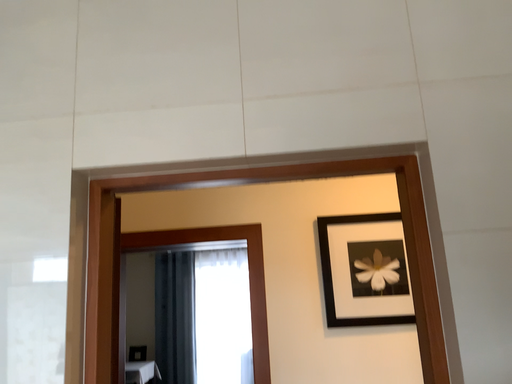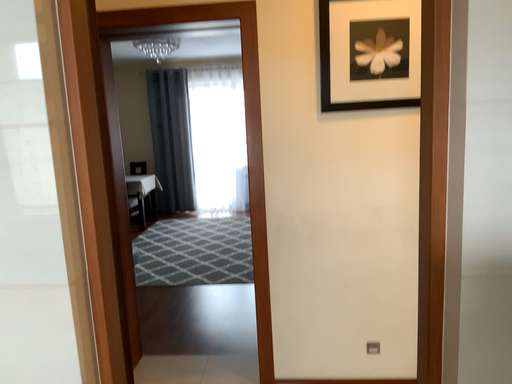
Question: Which way did the camera rotate in the video?

Choices:
 (A) rotated downward
 (B) rotated upward

Answer: (A)